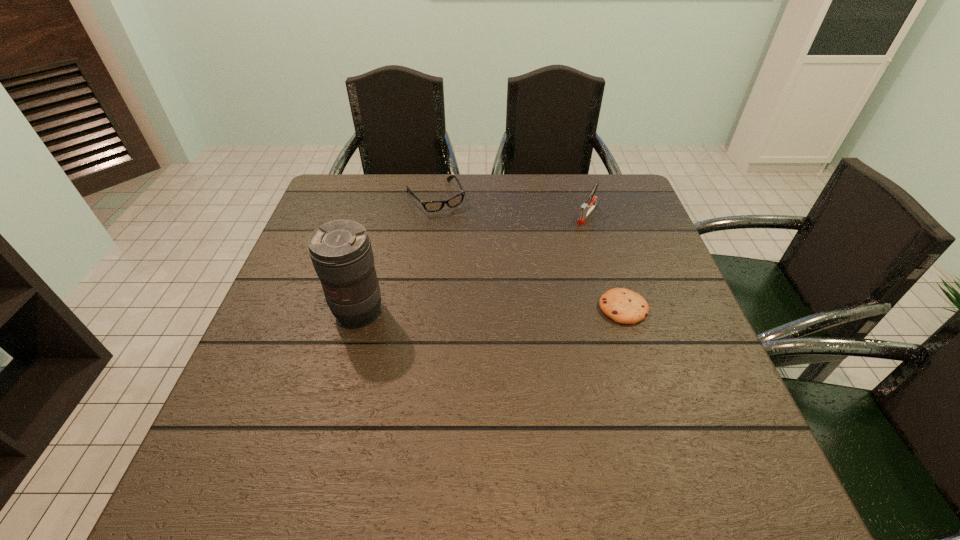
In the image, there is a desktop. At what (x,y) coordinates should I click in order to perform the action: click on vacant space at the left edge. Please return your answer as a coordinate pair (x, y). The height and width of the screenshot is (540, 960). Looking at the image, I should click on (320, 292).

Find the location of a particular element. free point at the right edge is located at coordinates (699, 364).

Where is `blank space at the far left corner`? The image size is (960, 540). blank space at the far left corner is located at coordinates (341, 178).

Locate an element on the screen. This screenshot has width=960, height=540. free spot at the far right corner of the desktop is located at coordinates (620, 188).

Identify the location of free point between the telephoto lens and the stapler. The width and height of the screenshot is (960, 540). (473, 263).

At what (x,y) coordinates should I click in order to perform the action: click on free space between the third tallest object and the third shortest object. Please return your answer as a coordinate pair (x, y). The height and width of the screenshot is (540, 960). Looking at the image, I should click on (512, 206).

Where is `free spot between the spectacles and the shortest object`? The image size is (960, 540). free spot between the spectacles and the shortest object is located at coordinates (529, 252).

Identify the location of vacant space that is in between the cookie and the tallest object. (491, 310).

In order to click on free point between the shortest object and the telephoto lens in this screenshot , I will do `click(491, 310)`.

I want to click on empty space that is in between the stapler and the spectacles, so click(512, 206).